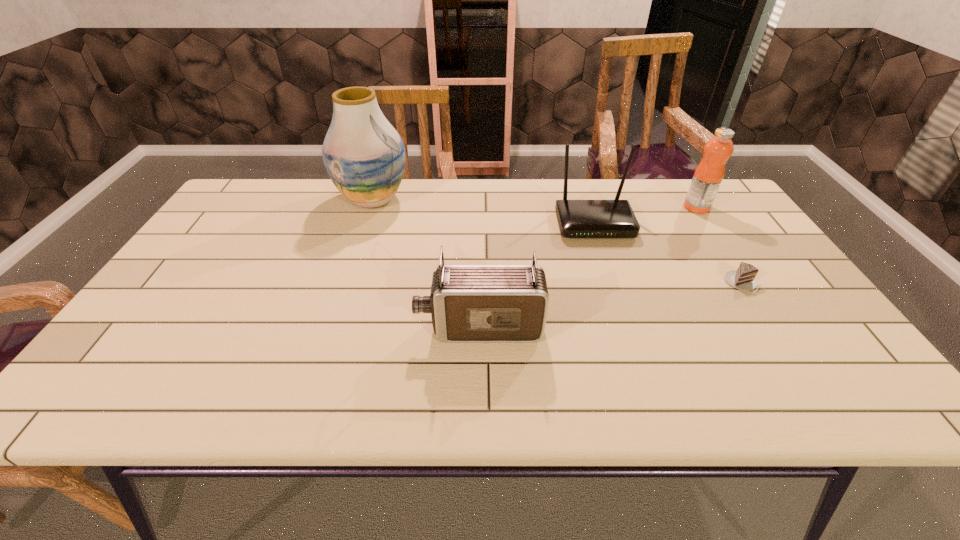
This screenshot has width=960, height=540. I want to click on free location located on the front-facing side of the router, so (634, 342).

Find the location of a particular element. Image resolution: width=960 pixels, height=540 pixels. vacant space situated 0.190m at the lens of the nearest object is located at coordinates [x=334, y=327].

You are a GUI agent. You are given a task and a screenshot of the screen. Output one action in this format:
    pyautogui.click(x=<x>, y=<y>)
    Task: Click on the free point located 0.160m at the lens of the nearest object
    The height and width of the screenshot is (540, 960).
    Given the screenshot: What is the action you would take?
    pyautogui.click(x=348, y=327)

This screenshot has height=540, width=960. What are the coordinates of `vacant region located 0.340m at the lens of the nearest object` in the screenshot? It's located at (268, 327).

At what (x,y) coordinates should I click in order to perform the action: click on free region located on the front of the fourth farthest object. Please return your answer as a coordinate pair (x, y). Image resolution: width=960 pixels, height=540 pixels. Looking at the image, I should click on (761, 313).

Locate an element on the screen. The width and height of the screenshot is (960, 540). vase positioned at the far edge is located at coordinates (364, 156).

I want to click on fruit juice present at the far edge, so click(x=709, y=174).

I want to click on router located in the far edge section of the desktop, so click(x=615, y=218).

At what (x,y) coordinates should I click in order to perform the action: click on fruit juice that is positioned at the right edge. Please return your answer as a coordinate pair (x, y). Looking at the image, I should click on (709, 174).

Where is `chocolate cake situated at the right edge`? This screenshot has height=540, width=960. chocolate cake situated at the right edge is located at coordinates (744, 278).